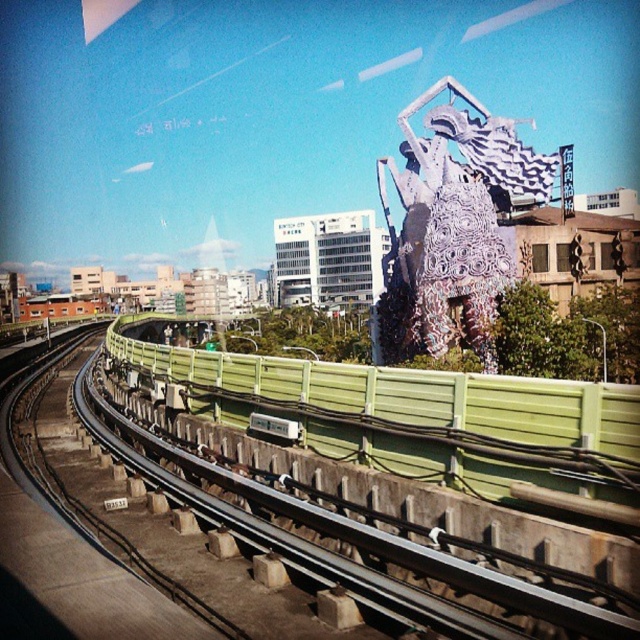
Question: Is green concrete rail at center wider than white metallic sculpture at upper right?

Choices:
 (A) no
 (B) yes

Answer: (B)

Question: Does green concrete rail at center appear on the right side of white metallic sculpture at upper right?

Choices:
 (A) yes
 (B) no

Answer: (B)

Question: Which point appears closest to the camera in this image?

Choices:
 (A) (448, 584)
 (B) (385, 330)

Answer: (A)

Question: Which of the following is the farthest from the observer?

Choices:
 (A) green concrete rail at center
 (B) white metallic sculpture at upper right

Answer: (B)

Question: Is green concrete rail at center to the left of white metallic sculpture at upper right from the viewer's perspective?

Choices:
 (A) yes
 (B) no

Answer: (A)

Question: Which point is closer to the camera?

Choices:
 (A) white metallic sculpture at upper right
 (B) green concrete rail at center

Answer: (B)